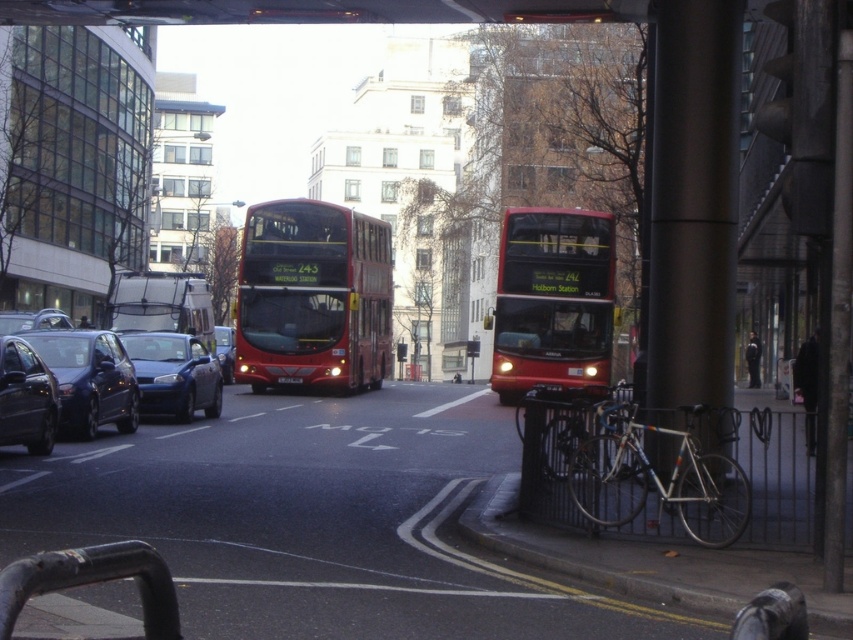
Question: Among these objects, which one is farthest from the camera?

Choices:
 (A) shiny black sedan at left
 (B) shiny dark blue sedan at lower left
 (C) metallic blue sedan at center-left

Answer: (C)

Question: Is red matte double-decker bus at center below black plastic license plate at center?

Choices:
 (A) no
 (B) yes

Answer: (A)

Question: Is shiny dark blue sedan at lower left bigger than metallic silver bus at center?

Choices:
 (A) no
 (B) yes

Answer: (A)

Question: Which of these objects is positioned farthest from the shiny black sedan at left?

Choices:
 (A) metallic blue sedan at center-left
 (B) metallic blue sedan at center
 (C) shiny red bus at center
 (D) metallic silver bus at center

Answer: (B)

Question: Which object appears closest to the camera in this image?

Choices:
 (A) shiny black sedan at left
 (B) metallic silver bus at center

Answer: (A)

Question: Where is red matte double-decker bus at center located in relation to black plastic license plate at center in the image?

Choices:
 (A) left
 (B) right

Answer: (B)